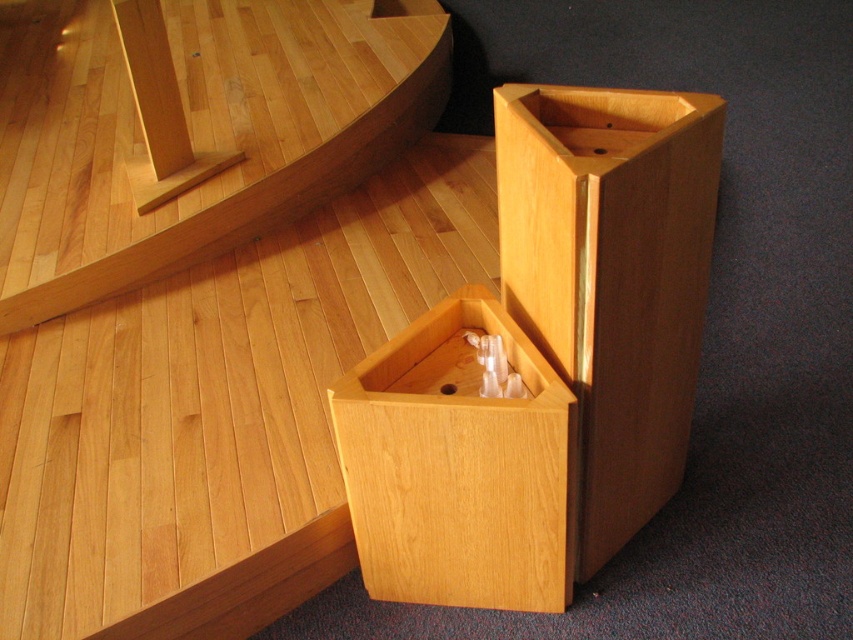
Question: Can you confirm if natural wood table at upper left is smaller than natural wood drawer at center?

Choices:
 (A) no
 (B) yes

Answer: (A)

Question: Which point is closer to the camera?

Choices:
 (A) natural wood table at upper left
 (B) natural wood drawer at center
 (C) light wood/wooden box at center

Answer: (C)

Question: Does natural wood table at upper left appear on the left side of natural wood drawer at center?

Choices:
 (A) yes
 (B) no

Answer: (A)

Question: Estimate the real-world distances between objects in this image. Which object is farther from the natural wood table at upper left?

Choices:
 (A) light wood/wooden box at center
 (B) natural wood drawer at center

Answer: (A)

Question: Can you confirm if light wood/wooden box at center is positioned to the left of natural wood table at upper left?

Choices:
 (A) no
 (B) yes

Answer: (A)

Question: Which of the following is the farthest from the observer?

Choices:
 (A) light wood/wooden box at center
 (B) natural wood table at upper left
 (C) natural wood drawer at center

Answer: (B)